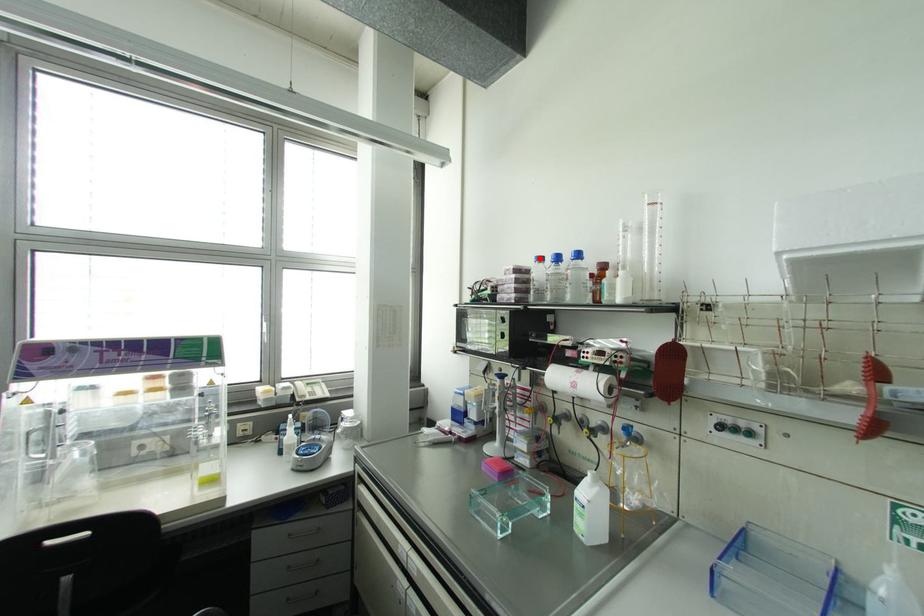
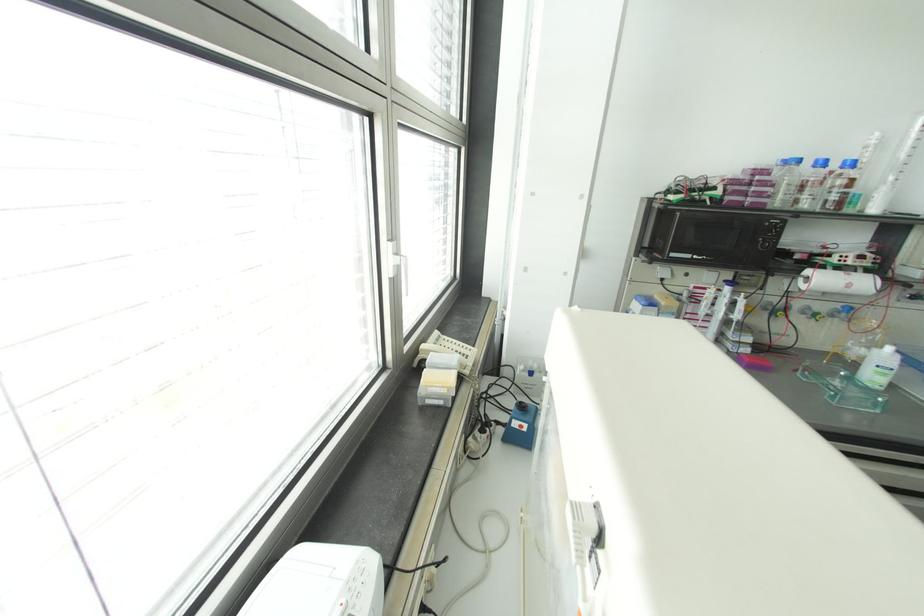
Locate, in the second image, the point that corresponds to the highlighted location in the first image.

(797, 160)